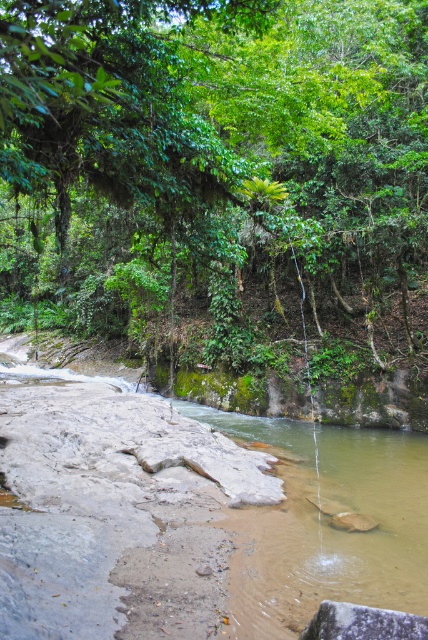
Question: Which object appears closest to the camera in this image?

Choices:
 (A) brown rocky river at center
 (B) green leafy forest at upper center

Answer: (B)

Question: Is green leafy forest at upper center to the right of brown rocky river at center from the viewer's perspective?

Choices:
 (A) yes
 (B) no

Answer: (B)

Question: Does green leafy forest at upper center appear under brown rocky river at center?

Choices:
 (A) yes
 (B) no

Answer: (B)

Question: Is green leafy forest at upper center smaller than brown rocky river at center?

Choices:
 (A) yes
 (B) no

Answer: (B)

Question: Among these objects, which one is farthest from the camera?

Choices:
 (A) brown rocky river at center
 (B) green leafy forest at upper center

Answer: (A)

Question: Which point is closer to the camera?

Choices:
 (A) (265, 477)
 (B) (55, 296)

Answer: (A)